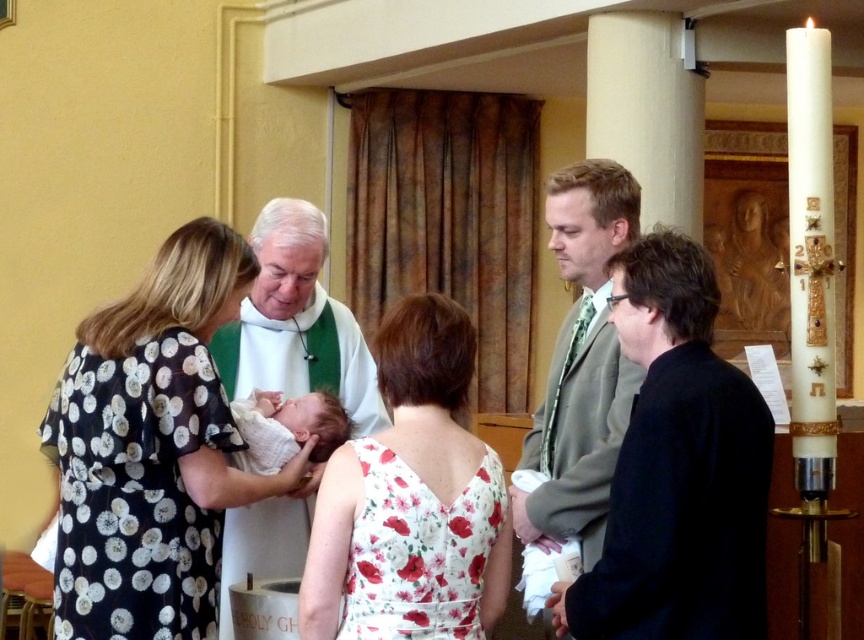
You are a photographer trying to capture the baptism scene. You notice the white floral dress at center and the white soft cloth at center. Which one is wider?

The white floral dress at center is wider than the white soft cloth at center according to the description.

Consider the image. You are a photographer at the baptism ceremony. You need to capture a closeup shot of the baby while ensuring both the white floral dress at center and the white soft cloth at center are visible. Which object should you focus on to ensure both are in frame without moving the camera?

You should focus on the white floral dress at center because it has a larger size compared to the white soft cloth at center, making it easier to frame both objects in the shot.

You are attending a baptism ceremony and see the white floral dress at center and the white soft cloth at center. Which object is positioned to the right?

The white floral dress at center is positioned to the right of the white soft cloth at center.